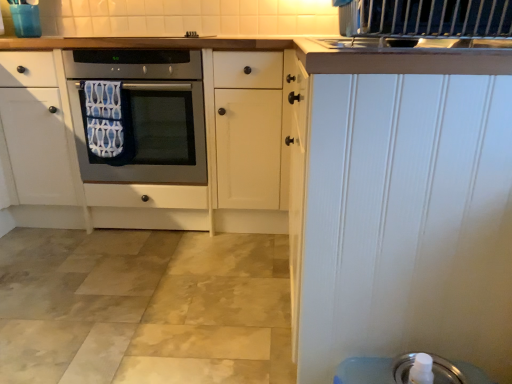
Question: Does silver metallic soap dispenser at lower right have a lesser height compared to satin silver oven at center?

Choices:
 (A) no
 (B) yes

Answer: (B)

Question: Can you confirm if silver metallic soap dispenser at lower right is positioned to the right of satin silver oven at center?

Choices:
 (A) yes
 (B) no

Answer: (A)

Question: Is silver metallic soap dispenser at lower right bigger than satin silver oven at center?

Choices:
 (A) yes
 (B) no

Answer: (B)

Question: Could you tell me if silver metallic soap dispenser at lower right is facing satin silver oven at center?

Choices:
 (A) yes
 (B) no

Answer: (B)

Question: Is satin silver oven at center at the back of silver metallic soap dispenser at lower right?

Choices:
 (A) yes
 (B) no

Answer: (B)

Question: Is silver metallic soap dispenser at lower right smaller than satin silver oven at center?

Choices:
 (A) yes
 (B) no

Answer: (A)

Question: Is satin silver oven at center taller than white painted wood door at upper right?

Choices:
 (A) no
 (B) yes

Answer: (A)

Question: Does satin silver oven at center come in front of white painted wood door at upper right?

Choices:
 (A) yes
 (B) no

Answer: (B)

Question: Does satin silver oven at center contain white painted wood door at upper right?

Choices:
 (A) yes
 (B) no

Answer: (B)

Question: Is satin silver oven at center smaller than white painted wood door at upper right?

Choices:
 (A) no
 (B) yes

Answer: (B)

Question: From a real-world perspective, is satin silver oven at center beneath white painted wood door at upper right?

Choices:
 (A) no
 (B) yes

Answer: (A)

Question: Is satin silver oven at center facing away from white painted wood door at upper right?

Choices:
 (A) no
 (B) yes

Answer: (A)

Question: From a real-world perspective, is blue patterned towel at center positioned over satin silver oven at center based on gravity?

Choices:
 (A) no
 (B) yes

Answer: (B)